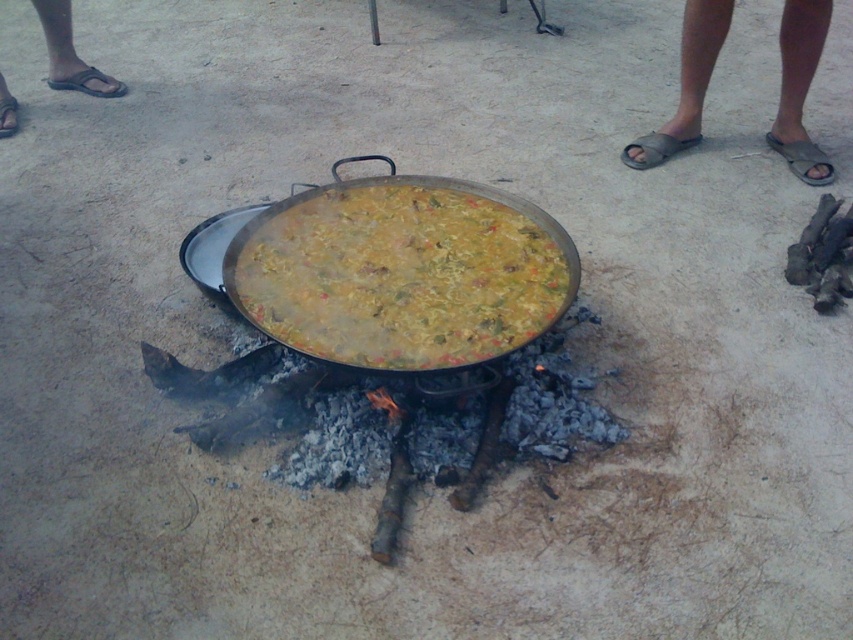
You are a guest at an outdoor cooking event and want to reach the gray fabric sandals at right without stepping on the yellowish matte paella at center. Based on their positions, which direction should you move from the paella to avoid it?

The yellowish matte paella at center is to the left of the gray fabric sandals at right. To avoid stepping on the paella, you should move to the right from the paella towards the sandals.

You are a chef preparing a meal and need to access the paella. There is a yellowish matte paella at center and gray fabric sandals at right in your view. Which object is closer to you?

The yellowish matte paella at center is positioned under gray fabric sandals at right, meaning it is closer to you since it is beneath the sandals.

You are a chef preparing a meal and need to access the gray fabric sandals at right. However, there is a hot yellowish matte paella at center in the way. Can you reach the sandals without moving the paella?

The yellowish matte paella at center is in front of the gray fabric sandals at right, so you cannot reach the sandals without moving the paella because it is blocking the path.